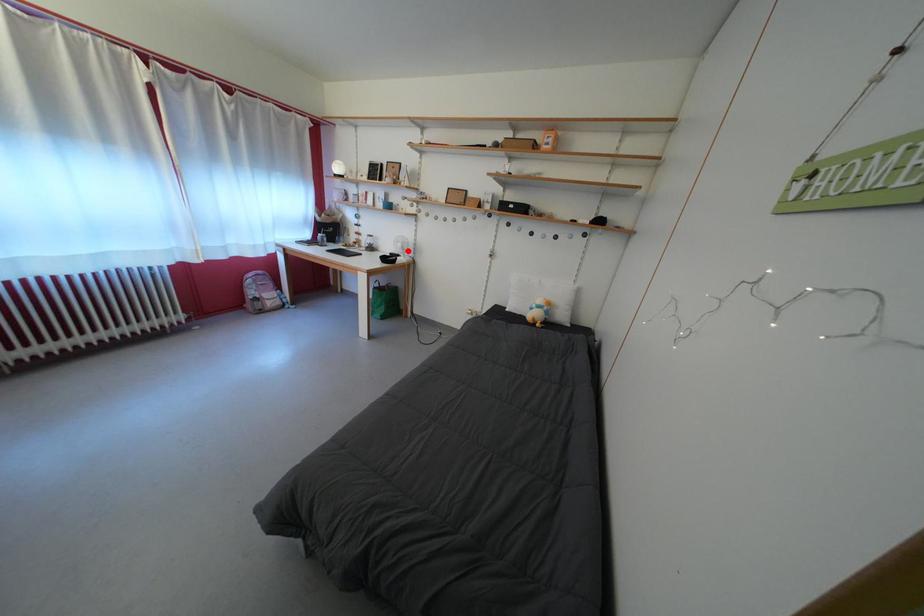
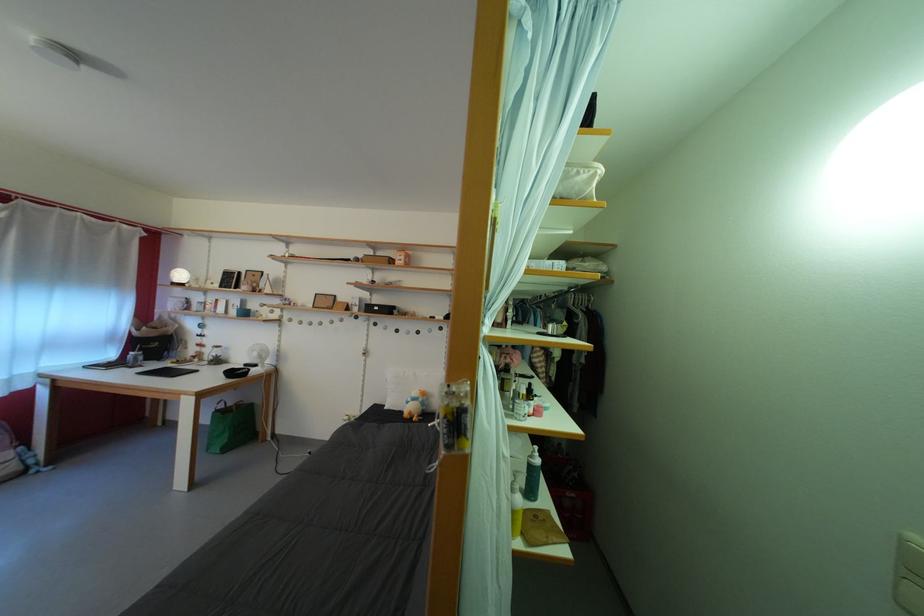
Question: I am providing you with two images of the same scene from different viewpoints. Image1 has a red point marked. In image2, the corresponding 3D location appears at what relative position? Reply with the corresponding letter.

Choices:
 (A) Closer
 (B) Farther

Answer: (B)